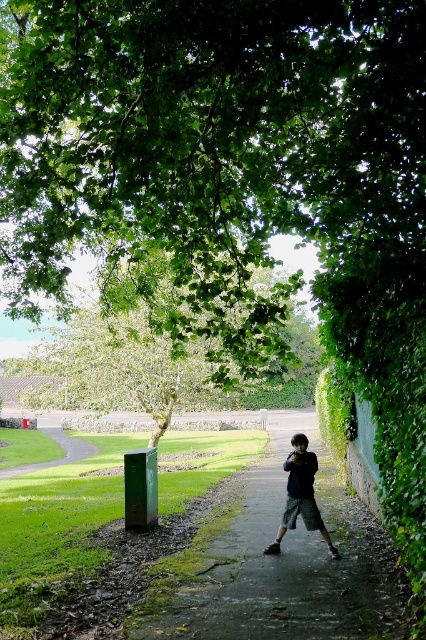
You are a gardener planning to place a decorative stone on the smooth concrete pavement at center. Considering the size of the dark green textured shorts at center, will the stone fit comfortably on the pavement?

The smooth concrete pavement at center is bigger than the dark green textured shorts at center, so the stone should fit comfortably on the pavement as there is enough space.

You are planning to place a picnic blanket. The green leafy tree at upper center and the smooth concrete pavement at center are both options. Which location has more space for the blanket?

The smooth concrete pavement at center has more space because the green leafy tree at upper center occupies less space than it.

You are a photographer standing at the camera position. You want to take a photo that includes both the green leafy tree at upper center and a small red flower that is 3.20 meters in front of the camera. Will the flower be in front of or behind the tree in the photo?

The green leafy tree at upper center is 4.40 meters from the camera, while the small red flower is 3.20 meters in front of the camera. Since 3.20 meters is closer than 4.40 meters, the flower will be in front of the tree in the photo.